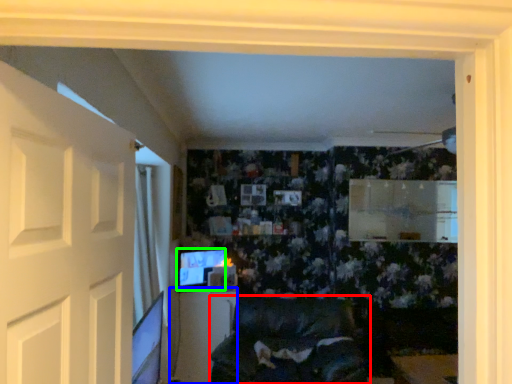
Question: Which is farther away from furniture (highlighted by a red box)? table (highlighted by a blue box) or computer monitor (highlighted by a green box)?

Choices:
 (A) table
 (B) computer monitor

Answer: (B)